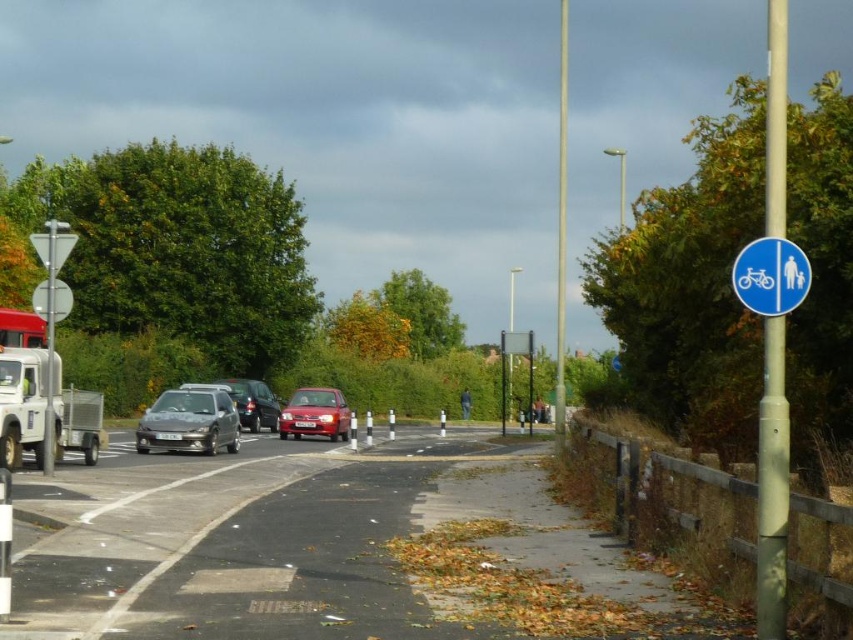
Question: Is shiny red car at center wider than metallic silver car at center?

Choices:
 (A) yes
 (B) no

Answer: (A)

Question: Which point is closer to the camera?

Choices:
 (A) (260, 413)
 (B) (201, 401)
 (C) (292, 410)
 (D) (746, 248)

Answer: (D)

Question: Which point is farther to the camera?

Choices:
 (A) (314, 394)
 (B) (757, 307)
 (C) (265, 401)

Answer: (C)

Question: Among these points, which one is farthest from the camera?

Choices:
 (A) (241, 412)
 (B) (751, 282)
 (C) (148, 451)
 (D) (329, 438)

Answer: (A)

Question: Is metallic gray hatchback at center thinner than shiny red car at center?

Choices:
 (A) no
 (B) yes

Answer: (B)

Question: Does metallic gray hatchback at center come in front of blue plastic sign at upper right?

Choices:
 (A) no
 (B) yes

Answer: (A)